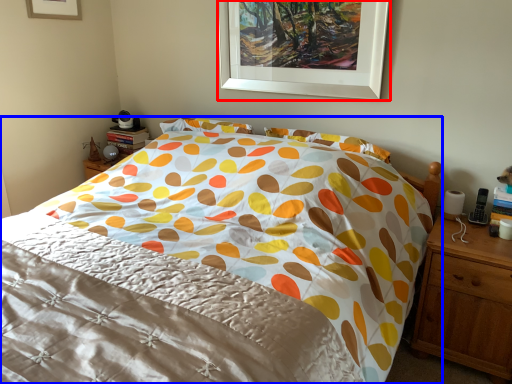
Question: Which point is closer to the camera, picture frame (highlighted by a red box) or bed (highlighted by a blue box)?

Choices:
 (A) picture frame
 (B) bed

Answer: (B)